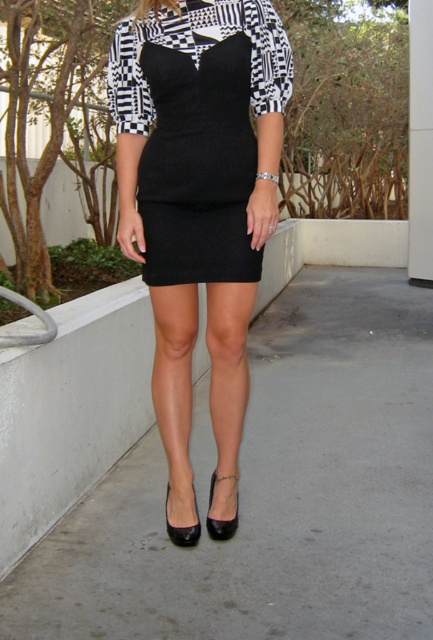
From the picture: Does white glossy pillar at right appear on the right side of black leather sandal at lower center?

Yes, white glossy pillar at right is to the right of black leather sandal at lower center.

Is white glossy pillar at right thinner than black leather sandal at lower center?

In fact, white glossy pillar at right might be wider than black leather sandal at lower center.

Is point (429, 44) positioned after point (180, 529)?

Yes.

You are a GUI agent. You are given a task and a screenshot of the screen. Output one action in this format:
    pyautogui.click(x=<x>, y=<y>)
    Task: Click on the white glossy pillar at right
    The width and height of the screenshot is (433, 640).
    Given the screenshot: What is the action you would take?
    pyautogui.click(x=420, y=141)

Is satin black dress at center below black leather sandal at lower center?

Actually, satin black dress at center is above black leather sandal at lower center.

Which is in front, point (135, 92) or point (175, 536)?

Point (135, 92) is in front.

Identify the location of satin black dress at center. This screenshot has width=433, height=640. (199, 196).

Between point (186, 38) and point (416, 76), which one is positioned behind?

Positioned behind is point (416, 76).

Does satin black dress at center have a greater height compared to white glossy pillar at right?

No, satin black dress at center is not taller than white glossy pillar at right.

You are a GUI agent. You are given a task and a screenshot of the screen. Output one action in this format:
    pyautogui.click(x=<x>, y=<y>)
    Task: Click on the satin black dress at center
    This screenshot has width=433, height=640.
    Given the screenshot: What is the action you would take?
    pyautogui.click(x=199, y=196)

Where is `satin black dress at center`? This screenshot has width=433, height=640. satin black dress at center is located at coordinates (199, 196).